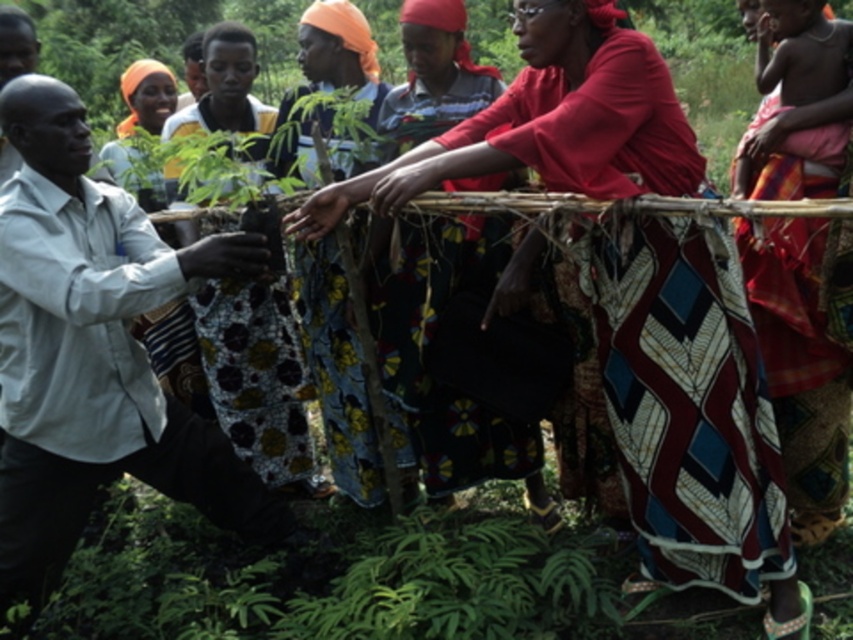
Is red woven cloth at center wider than light gray shirt at left?

Indeed, red woven cloth at center has a greater width compared to light gray shirt at left.

Is red woven cloth at center shorter than light gray shirt at left?

No.

Find the location of a particular element. This screenshot has width=853, height=640. red woven cloth at center is located at coordinates (692, 412).

Find the location of a particular element. The width and height of the screenshot is (853, 640). red woven cloth at center is located at coordinates (692, 412).

Find the location of a particular element. The image size is (853, 640). red woven cloth at center is located at coordinates (692, 412).

Can you confirm if red woven cloth at center is thinner than matte orange headscarf at upper left?

No, red woven cloth at center is not thinner than matte orange headscarf at upper left.

Which is behind, point (653, 285) or point (152, 92)?

The point (152, 92) is behind.

The image size is (853, 640). I want to click on red woven cloth at center, so click(x=692, y=412).

Is point (15, 561) less distant than point (109, 141)?

Yes, it is.

Is light gray shirt at left taller than matte orange headscarf at upper left?

Yes.

The image size is (853, 640). What do you see at coordinates (96, 353) in the screenshot?
I see `light gray shirt at left` at bounding box center [96, 353].

Identify the location of light gray shirt at left. The width and height of the screenshot is (853, 640). point(96,353).